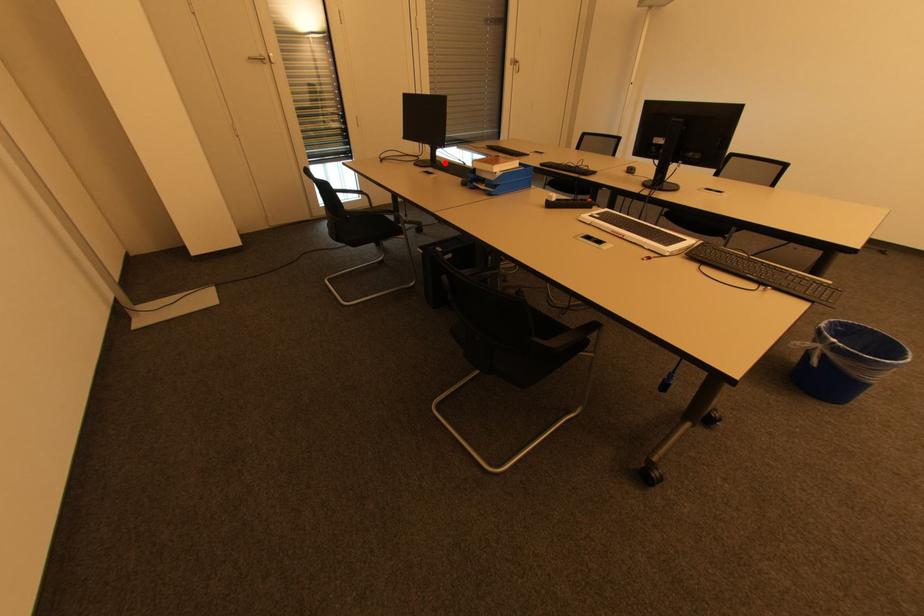
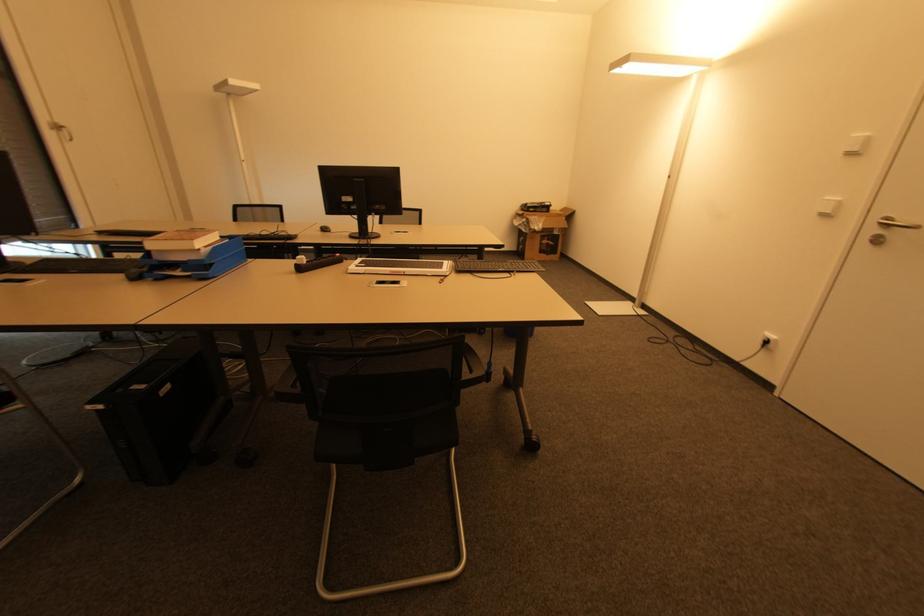
The point at the highlighted location is marked in the first image. Where is the corresponding point in the second image?

(30, 264)